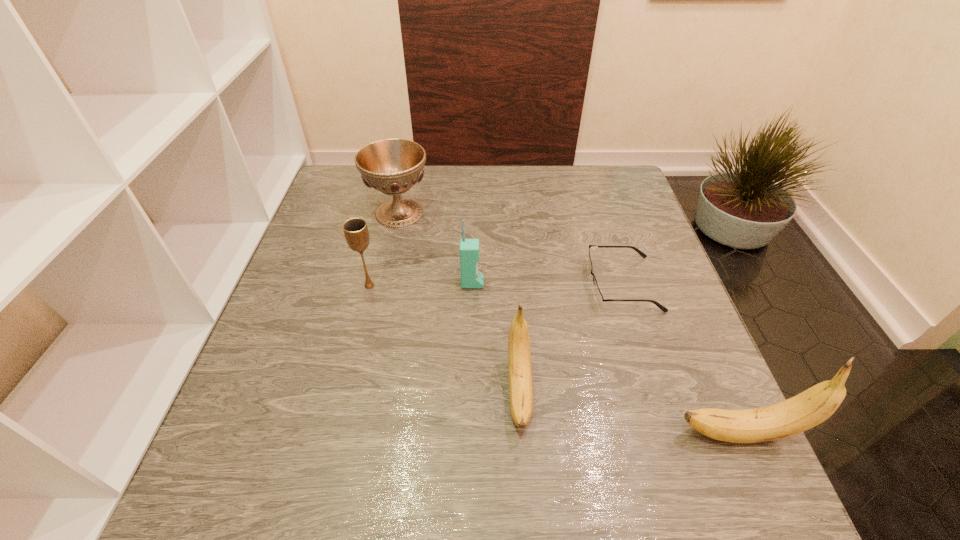
This screenshot has height=540, width=960. Find the location of `vacant region located at the start of the peel on the right banana`. vacant region located at the start of the peel on the right banana is located at coordinates (467, 434).

Locate an element on the screen. The width and height of the screenshot is (960, 540). vacant space located 0.310m on the right of the farthest object is located at coordinates (542, 213).

At what (x,y) coordinates should I click in order to perform the action: click on vacant space located 0.190m on the front-facing side of the shortest object. Please return your answer as a coordinate pair (x, y). This screenshot has height=540, width=960. Looking at the image, I should click on (507, 284).

At what (x,y) coordinates should I click in order to perform the action: click on free location located on the front-facing side of the shortest object. Please return your answer as a coordinate pair (x, y). Looking at the image, I should click on (447, 284).

At what (x,y) coordinates should I click in order to perform the action: click on vacant space located on the front-facing side of the shortest object. Please return your answer as a coordinate pair (x, y). Image resolution: width=960 pixels, height=540 pixels. Looking at the image, I should click on (447, 284).

The image size is (960, 540). I want to click on vacant space situated on the back of the nearer chalice, so pyautogui.click(x=393, y=192).

You are a GUI agent. You are given a task and a screenshot of the screen. Output one action in this format:
    pyautogui.click(x=<x>, y=<y>)
    Task: Click on the vacant space situated 0.060m on the keypad of the cellular telephone
    This screenshot has height=540, width=960.
    Given the screenshot: What is the action you would take?
    pyautogui.click(x=509, y=283)

This screenshot has width=960, height=540. Identify the location of object located at the far edge. (392, 166).

Locate an element on the screen. object that is positioned at the left edge is located at coordinates (392, 166).

Image resolution: width=960 pixels, height=540 pixels. Identify the location of banana located in the right edge section of the desktop. (813, 406).